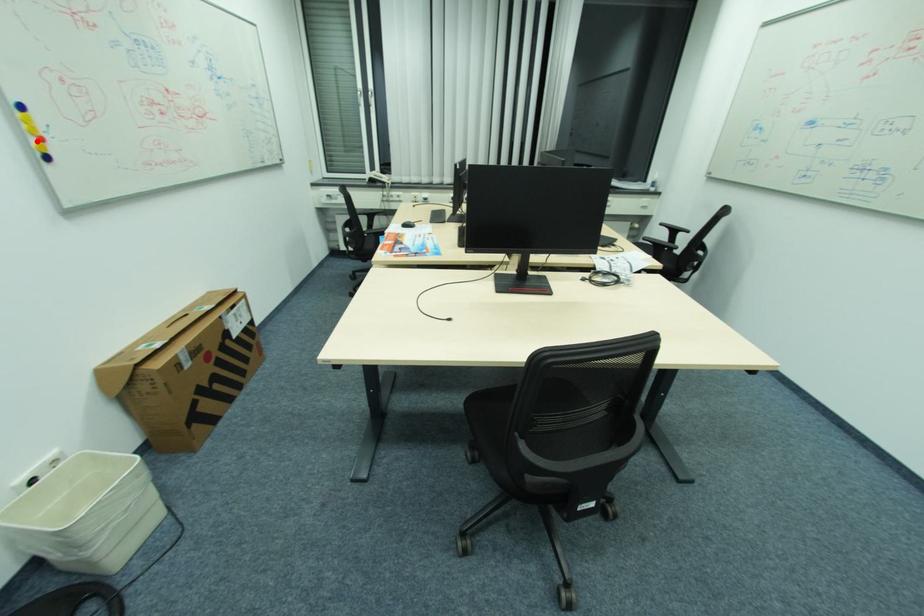
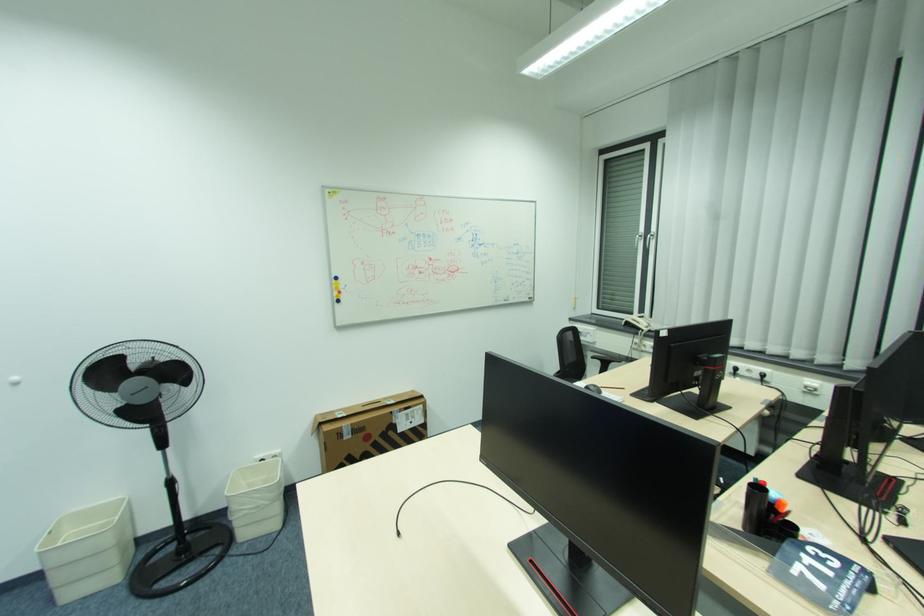
The point at the highlighted location is marked in the first image. Where is the corresponding point in the second image?

(341, 294)